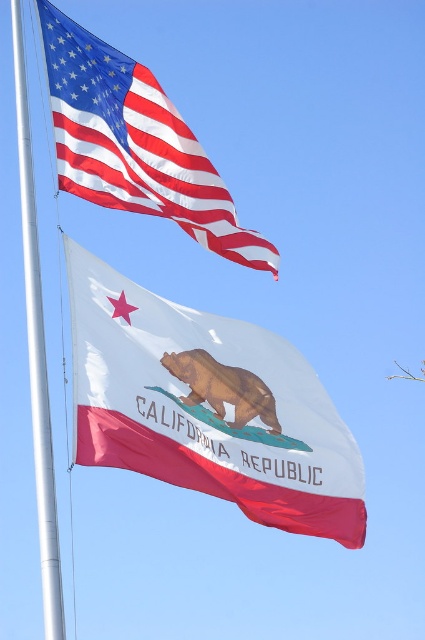
You are an observer looking at the two flags. Which object has a larger size between the white glossy fabric flag at center and the brown matte bear at center?

The white glossy fabric flag at center has a larger size compared to the brown matte bear at center.

You are a photographer trying to capture both the white glossy fabric flag at center and the silver metallic flag pole at left in a single shot. Based on their sizes, which object will appear smaller in the photo?

The white glossy fabric flag at center is not as tall as the silver metallic flag pole at left, so it will appear smaller in the photo.